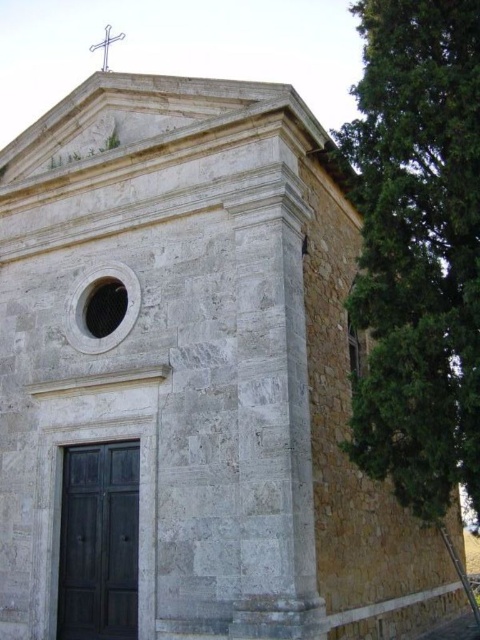
You are standing in front of the church and want to plant a new tree exactly 100 feet away from where you are standing. If you already have the green textured tree at right planted at its current location, is the existing tree too close to your desired planting spot?

The green textured tree at right is currently 77.66 feet away from the viewer. Since 77.66 feet is less than 100 feet, the existing tree is too close to the desired planting spot.

You are standing in front of the church and want to take a photo that includes both the green textured tree at right and the white wooden cross at upper center. Based on their positions, which object should you position to your left side to frame them properly?

The green textured tree at right is to the right of the white wooden cross at upper center. To frame them properly, position the white wooden cross at upper center to your left side so that the green textured tree at right appears on the right side of the photo.

You are a photographer planning to take a photo of the church. You want to include both the green textured tree at right and the white wooden cross at upper center in your shot. Which object will appear bigger in the photo?

The green textured tree at right will appear bigger in the photo because it is larger in size than the white wooden cross at upper center.